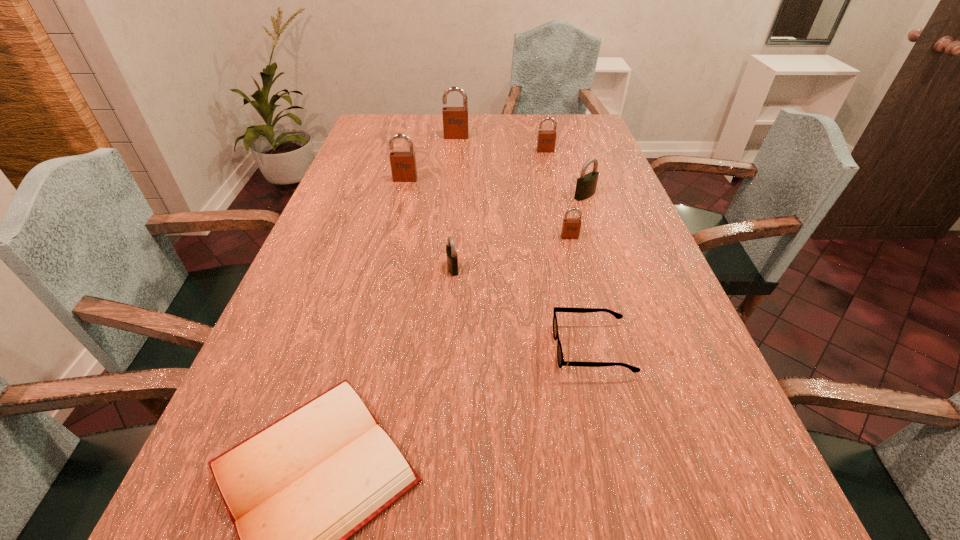
You are a GUI agent. You are given a task and a screenshot of the screen. Output one action in this format:
    pyautogui.click(x=<x>, y=<y>)
    Task: Click on the tallest padlock
    The image size is (960, 540).
    Given the screenshot: What is the action you would take?
    pyautogui.click(x=455, y=119)

The image size is (960, 540). In order to click on the biggest brown padlock in this screenshot , I will do `click(455, 119)`.

The height and width of the screenshot is (540, 960). What are the coordinates of `the third farthest brown padlock` in the screenshot? It's located at click(x=403, y=164).

Find the location of a particular element. the third smallest brown padlock is located at coordinates (403, 164).

Locate an element on the screen. This screenshot has width=960, height=540. the third nearest padlock is located at coordinates (586, 184).

The height and width of the screenshot is (540, 960). In order to click on the bigger black padlock in this screenshot , I will do `click(586, 184)`.

I want to click on the third biggest brown padlock, so click(x=546, y=141).

At what (x,y) coordinates should I click in order to perform the action: click on the third nearest brown padlock. Please return your answer as a coordinate pair (x, y). Looking at the image, I should click on (546, 141).

I want to click on the nearer black padlock, so tap(452, 258).

You are a GUI agent. You are given a task and a screenshot of the screen. Output one action in this format:
    pyautogui.click(x=<x>, y=<y>)
    Task: Click on the sixth farthest object
    The height and width of the screenshot is (540, 960).
    Given the screenshot: What is the action you would take?
    pyautogui.click(x=452, y=258)